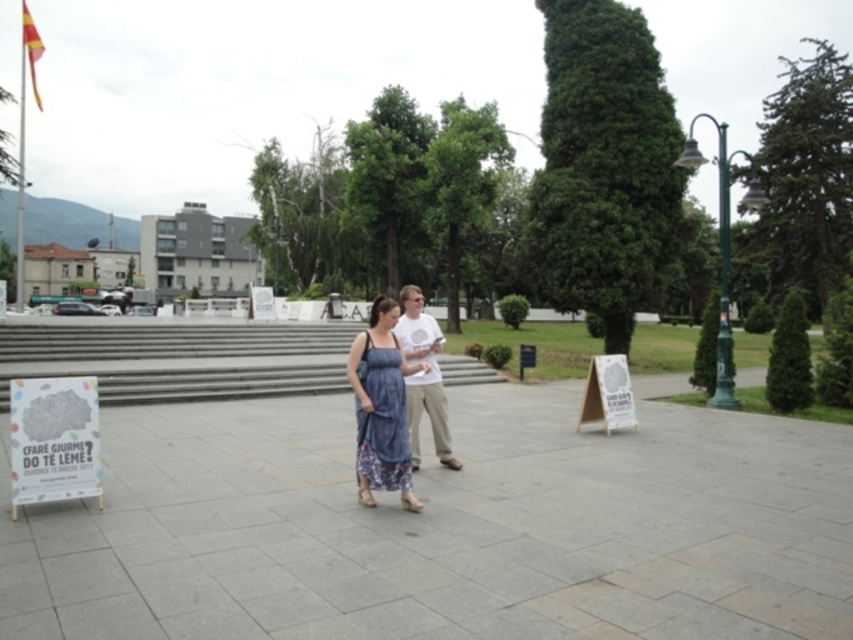
Question: Which point is farther to the camera?

Choices:
 (A) white cotton t-shirt at center
 (B) dusty blue floral dress at center

Answer: (A)

Question: In this image, where is denim dress at center located relative to white cotton t-shirt at center?

Choices:
 (A) below
 (B) above

Answer: (A)

Question: Does dusty blue floral dress at center come behind white cotton t-shirt at center?

Choices:
 (A) no
 (B) yes

Answer: (A)

Question: Which of the following is the farthest from the observer?

Choices:
 (A) denim dress at center
 (B) white cotton t-shirt at center
 (C) dusty blue floral dress at center

Answer: (B)

Question: Can you confirm if denim dress at center is positioned to the right of dusty blue floral dress at center?

Choices:
 (A) no
 (B) yes

Answer: (A)

Question: Which of the following is the farthest from the observer?

Choices:
 (A) denim dress at center
 (B) white cotton t-shirt at center

Answer: (B)